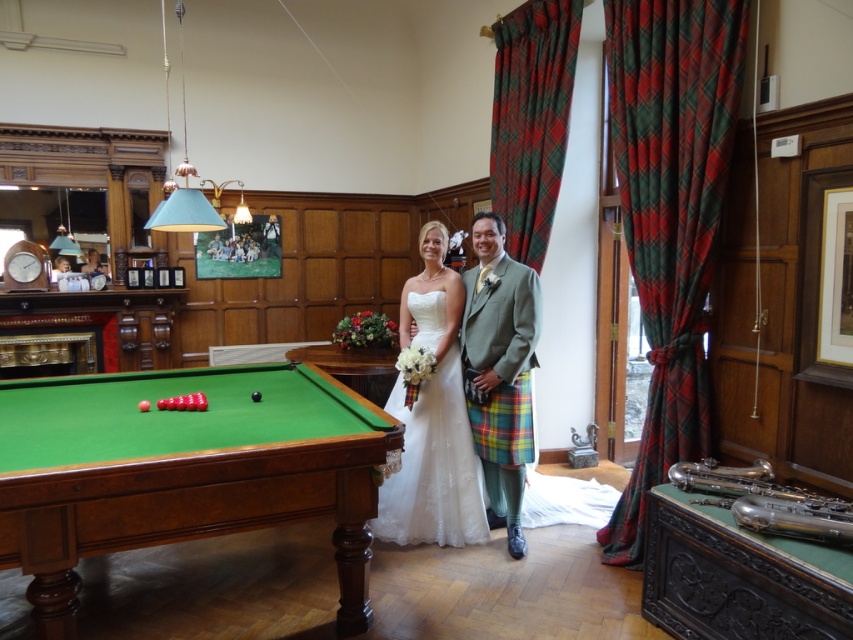
Question: Is the position of green wood billiard table at lower left more distant than that of white satin dress at center?

Choices:
 (A) no
 (B) yes

Answer: (A)

Question: Which is nearer to the green wood billiard table at lower left?

Choices:
 (A) green plaid kilt at center
 (B) white satin dress at center

Answer: (B)

Question: Which is farther from the green wood billiard table at lower left?

Choices:
 (A) white satin dress at center
 (B) green plaid kilt at center

Answer: (B)

Question: From the image, what is the correct spatial relationship of green wood billiard table at lower left in relation to green plaid kilt at center?

Choices:
 (A) below
 (B) above

Answer: (A)

Question: Which point is farther from the camera taking this photo?

Choices:
 (A) (498, 419)
 (B) (434, 532)
 (C) (256, 388)

Answer: (B)

Question: Does white satin dress at center come in front of green plaid kilt at center?

Choices:
 (A) no
 (B) yes

Answer: (A)